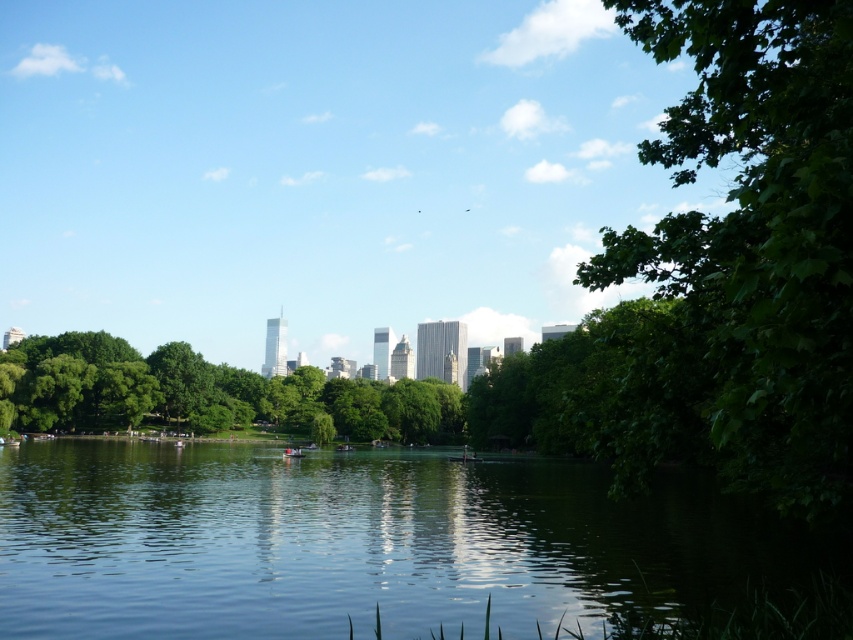
Between green reflective water at center and green leafy tree at right, which one is positioned higher?

green leafy tree at right is above.

Does point (463, 552) lie in front of point (729, 454)?

Yes.

Find the location of `green reflective water at center`. green reflective water at center is located at coordinates (363, 544).

Does green reflective water at center have a lesser width compared to green leafy tree at center?

Indeed, green reflective water at center has a lesser width compared to green leafy tree at center.

Does point (602, 483) lie behind point (7, 385)?

No.

Identify the location of green reflective water at center. The height and width of the screenshot is (640, 853). (363, 544).

Between green leafy tree at right and green leafy tree at center, which one has more height?

green leafy tree at right is taller.

Can you confirm if green leafy tree at right is thinner than green leafy tree at center?

Indeed, green leafy tree at right has a lesser width compared to green leafy tree at center.

Is point (660, 147) less distant than point (109, 419)?

Yes, it is.

Where is `green leafy tree at right`? The height and width of the screenshot is (640, 853). green leafy tree at right is located at coordinates (750, 244).